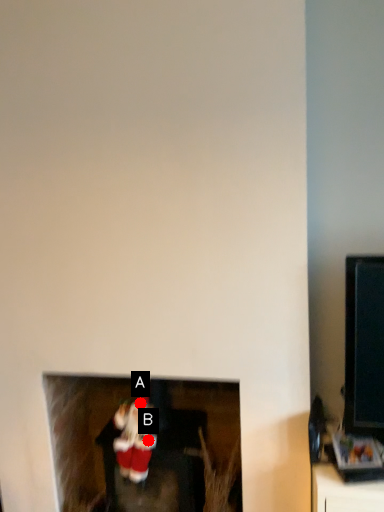
Question: Two points are circled on the image, labeled by A and B beside each circle. Which point appears closest to the camera in this image?

Choices:
 (A) A is closer
 (B) B is closer

Answer: (B)